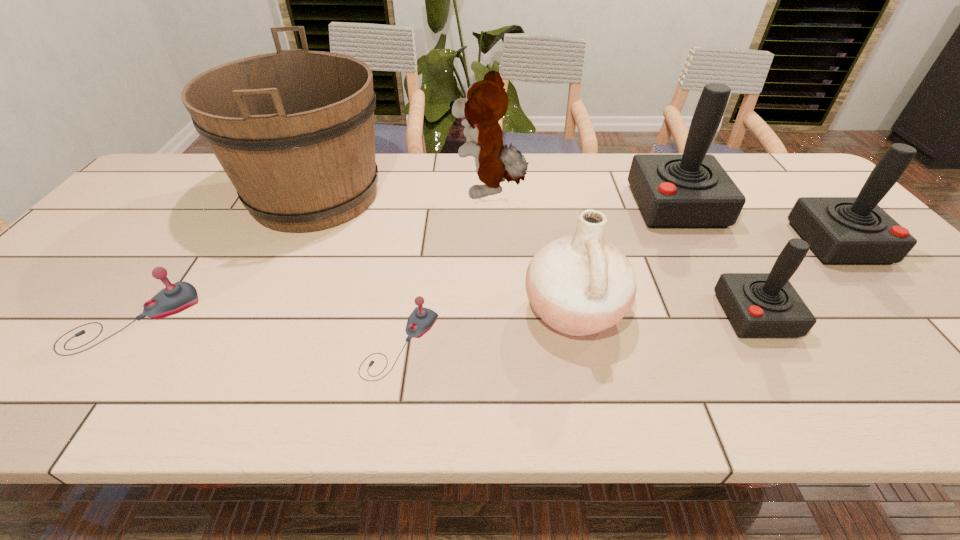
The height and width of the screenshot is (540, 960). I want to click on the fourth joystick from right to left, so click(421, 320).

Find the location of a particular element. The width and height of the screenshot is (960, 540). the right gray joystick is located at coordinates (421, 320).

Where is `blank area located on the right of the bucket`? blank area located on the right of the bucket is located at coordinates (493, 196).

At what (x,y) coordinates should I click in order to perform the action: click on vacant area situated 0.380m on the base of the tallest joystick. Please return your answer as a coordinate pair (x, y). The width and height of the screenshot is (960, 540). Looking at the image, I should click on (505, 206).

This screenshot has width=960, height=540. In order to click on vacant point located 0.260m on the base of the tallest joystick in this screenshot , I will do `click(545, 206)`.

Locate an element on the screen. vacant space situated on the base of the tallest joystick is located at coordinates (532, 206).

Locate an element on the screen. This screenshot has height=540, width=960. free region located on the face of the brown puppy is located at coordinates (385, 191).

Locate an element on the screen. The width and height of the screenshot is (960, 540). free space located 0.100m on the face of the brown puppy is located at coordinates (420, 191).

At what (x,y) coordinates should I click in order to perform the action: click on free space located 0.400m on the face of the brown puppy. Please return your answer as a coordinate pair (x, y). This screenshot has width=960, height=540. Looking at the image, I should click on (323, 191).

Identify the location of free space located on the base of the second biggest red joystick. (941, 357).